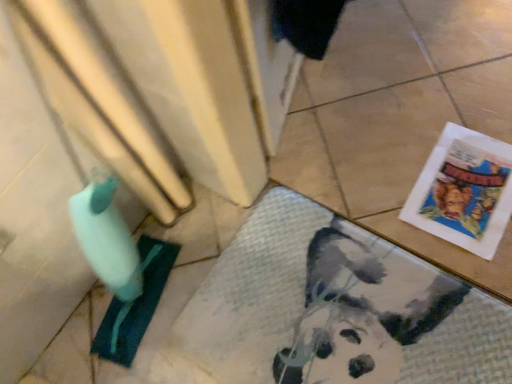
Describe the element at coordinates (332, 310) in the screenshot. I see `white textured bath mat at lower right` at that location.

Measure the distance between white textured bath mat at lower right and camera.

81.72 centimeters.

This screenshot has width=512, height=384. I want to click on white textured bath mat at lower right, so click(x=332, y=310).

What do you see at coordinates (464, 191) in the screenshot? I see `white paper comic book at lower right` at bounding box center [464, 191].

What are the coordinates of `white paper comic book at lower right` in the screenshot? It's located at (464, 191).

Where is `white textured bath mat at lower right`? white textured bath mat at lower right is located at coordinates (332, 310).

Visually, is white textured bath mat at lower right positioned to the left or to the right of white paper comic book at lower right?

In the image, white textured bath mat at lower right appears on the left side of white paper comic book at lower right.

Is the depth of white textured bath mat at lower right less than that of white paper comic book at lower right?

Yes.

Considering the positions of point (448, 281) and point (501, 150), is point (448, 281) closer or farther from the camera than point (501, 150)?

Point (448, 281) is positioned closer to the camera compared to point (501, 150).

From the image's perspective, which one is positioned lower, white textured bath mat at lower right or white paper comic book at lower right?

white textured bath mat at lower right, from the image's perspective.

Looking at this image, from a real-world perspective, does white textured bath mat at lower right stand above white paper comic book at lower right?

No.

Considering the relative sizes of white textured bath mat at lower right and white paper comic book at lower right in the image provided, is white textured bath mat at lower right thinner than white paper comic book at lower right?

In fact, white textured bath mat at lower right might be wider than white paper comic book at lower right.

Does white textured bath mat at lower right have a lesser height compared to white paper comic book at lower right?

No.

Looking at the image, does white textured bath mat at lower right seem bigger or smaller compared to white paper comic book at lower right?

Considering their sizes, white textured bath mat at lower right takes up more space than white paper comic book at lower right.

Looking at this image, is white textured bath mat at lower right completely or partially outside of white paper comic book at lower right?

Yes, white textured bath mat at lower right is outside of white paper comic book at lower right.

Is there a large distance between white textured bath mat at lower right and white paper comic book at lower right?

No.

Is white textured bath mat at lower right facing away from white paper comic book at lower right?

Correct, white textured bath mat at lower right is looking away from white paper comic book at lower right.

Find the location of a particular element. The image size is (512, 384). bath mat in front of the white paper comic book at lower right is located at coordinates (332, 310).

Is white paper comic book at lower right at the left side of white textured bath mat at lower right?

Incorrect, white paper comic book at lower right is not on the left side of white textured bath mat at lower right.

Is white paper comic book at lower right closer to camera compared to white textured bath mat at lower right?

No, it is behind white textured bath mat at lower right.

Considering the points (485, 182) and (396, 267), which point is behind, point (485, 182) or point (396, 267)?

Positioned behind is point (485, 182).

From the image's perspective, is white paper comic book at lower right over white textured bath mat at lower right?

Yes, from the image's perspective, white paper comic book at lower right is on top of white textured bath mat at lower right.

From a real-world perspective, is white paper comic book at lower right located beneath white textured bath mat at lower right?

Actually, white paper comic book at lower right is physically above white textured bath mat at lower right in the real world.

Does white paper comic book at lower right have a greater width compared to white textured bath mat at lower right?

No, white paper comic book at lower right is not wider than white textured bath mat at lower right.

Considering the sizes of objects white paper comic book at lower right and white textured bath mat at lower right in the image provided, who is shorter, white paper comic book at lower right or white textured bath mat at lower right?

Standing shorter between the two is white paper comic book at lower right.

Is white paper comic book at lower right bigger or smaller than white textured bath mat at lower right?

Clearly, white paper comic book at lower right is smaller in size than white textured bath mat at lower right.

Is white paper comic book at lower right positioned beyond the bounds of white textured bath mat at lower right?

Absolutely, white paper comic book at lower right is external to white textured bath mat at lower right.

Is white paper comic book at lower right beside white textured bath mat at lower right?

There is a gap between white paper comic book at lower right and white textured bath mat at lower right.

Is white paper comic book at lower right looking in the opposite direction of white textured bath mat at lower right?

No, white paper comic book at lower right is not facing the opposite direction of white textured bath mat at lower right.

Could you measure the distance between white paper comic book at lower right and white textured bath mat at lower right?

white paper comic book at lower right is 10.27 inches away from white textured bath mat at lower right.

The height and width of the screenshot is (384, 512). What are the coordinates of `comic book on the right of white textured bath mat at lower right` in the screenshot? It's located at (464, 191).

You are a GUI agent. You are given a task and a screenshot of the screen. Output one action in this format:
    pyautogui.click(x=<x>, y=<y>)
    Task: Click on the comic book behind the white textured bath mat at lower right
    
    Given the screenshot: What is the action you would take?
    pyautogui.click(x=464, y=191)

This screenshot has height=384, width=512. In order to click on comic book that is on the right side of white textured bath mat at lower right in this screenshot , I will do (464, 191).